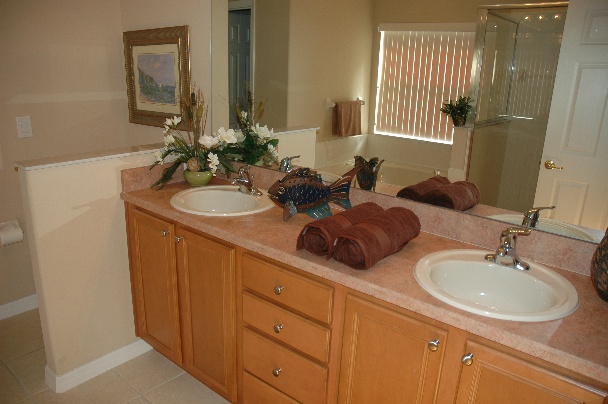
The image size is (608, 404). Identify the location of bathroom door. (581, 147).